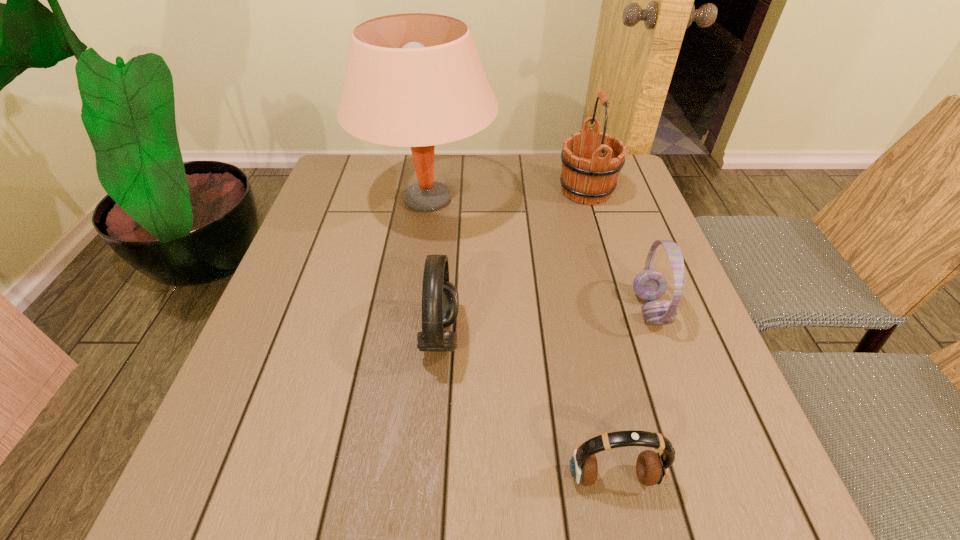
The height and width of the screenshot is (540, 960). What are the coordinates of `lampshade` in the screenshot? It's located at (416, 80).

The height and width of the screenshot is (540, 960). Find the location of `wine bucket`. wine bucket is located at coordinates (589, 173).

This screenshot has width=960, height=540. In order to click on the leftmost headset in this screenshot , I will do `click(440, 301)`.

The image size is (960, 540). In order to click on the rightmost headset in this screenshot , I will do `click(649, 285)`.

Locate an element on the screen. the nearest object is located at coordinates (652, 468).

Where is `the second headset from right to left`? the second headset from right to left is located at coordinates (652, 468).

Where is `free location located on the front-facing side of the lampshade`? The width and height of the screenshot is (960, 540). free location located on the front-facing side of the lampshade is located at coordinates (416, 285).

Locate an element on the screen. Image resolution: width=960 pixels, height=540 pixels. free spot located 0.070m on the left of the second tallest object is located at coordinates (532, 191).

Locate an element on the screen. The height and width of the screenshot is (540, 960). vacant space located 0.230m on the earcups of the leftmost headset is located at coordinates (573, 335).

I want to click on free space located on the headband and ear cups of the rightmost headset, so click(454, 309).